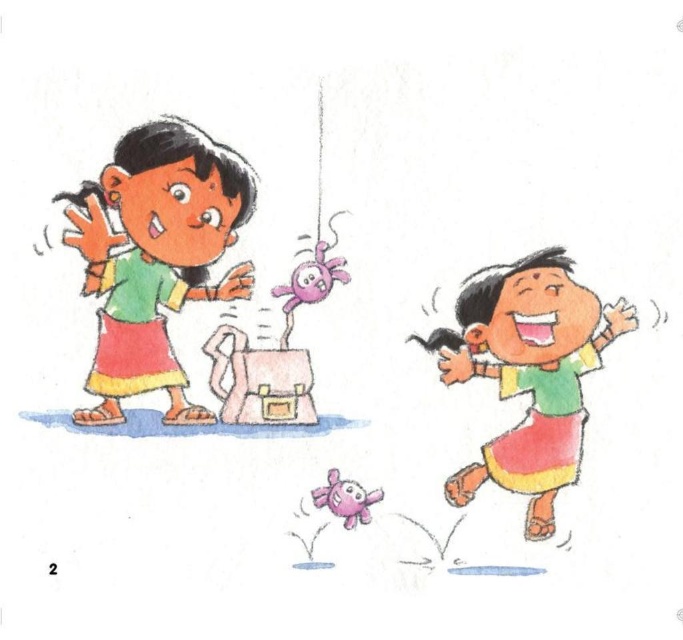
You are an AI analyzing the image. The point at coordinates (154, 257) is located on which object in the scene?

The point at coordinates (154, 257) is on the matte green shirt at left.

You are a fashion designer observing the two children in the scene. You notice the matte green shirt at left and the matte green skirt at right. Which clothing item is taller in height?

The matte green shirt at left is taller than the matte green skirt at right.